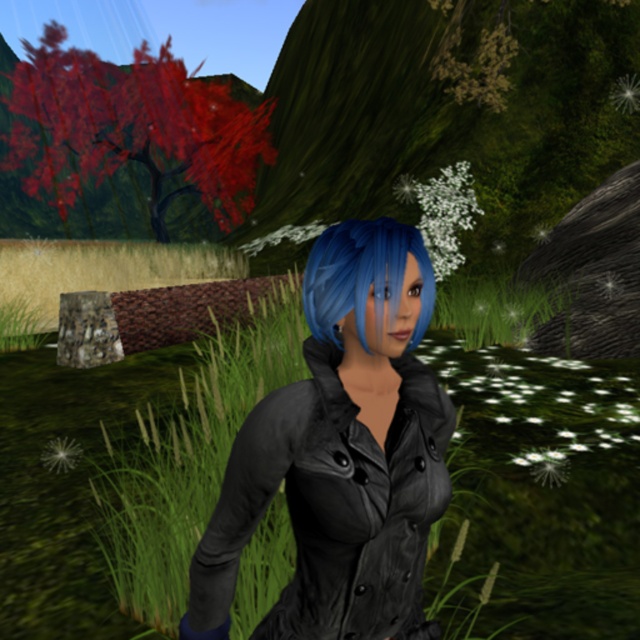
The character is wearing a matte black jacket at center and has blue matte hair at center. Which of these two items is taller?

The matte black jacket at center is taller than the blue matte hair at center.